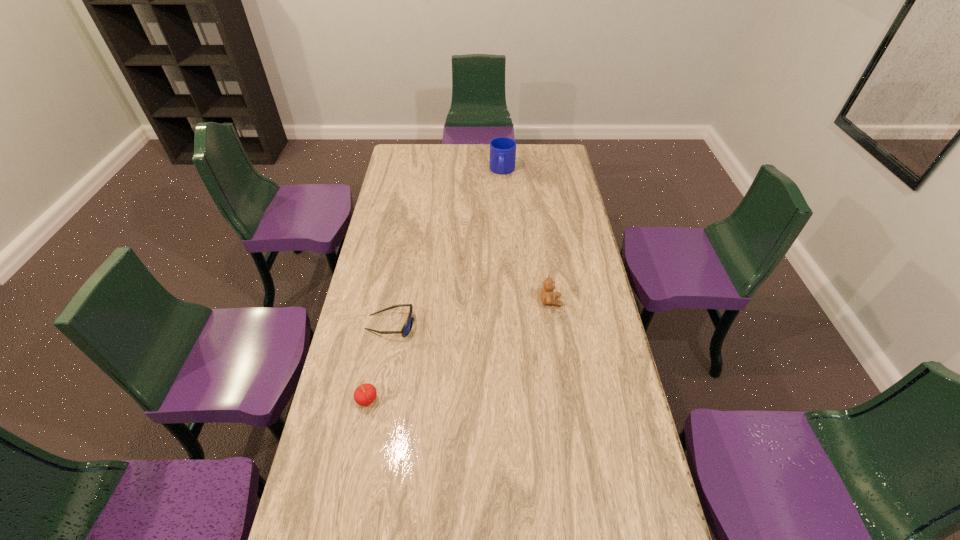
You are a GUI agent. You are given a task and a screenshot of the screen. Output one action in this format:
    pyautogui.click(x=<x>, y=<y>)
    Task: Click on the vacant position located 0.210m on the side with the handle of the mug
    The image size is (960, 540).
    Given the screenshot: What is the action you would take?
    pyautogui.click(x=498, y=207)

Where is `vacant space located on the side with the handle of the mug`? vacant space located on the side with the handle of the mug is located at coordinates (499, 200).

What are the coordinates of `vacant area situated 0.200m on the side with the handle of the mug` in the screenshot? It's located at (498, 206).

Find the location of `object situated at the far edge`. object situated at the far edge is located at coordinates (502, 149).

Find the location of `cherry that is positioned at the left edge`. cherry that is positioned at the left edge is located at coordinates (x=365, y=394).

Identify the location of sunglasses present at the left edge. (408, 324).

At what (x,y) coordinates should I click in order to perform the action: click on object that is at the right edge. Please return your answer as a coordinate pair (x, y). This screenshot has width=960, height=540. Looking at the image, I should click on (548, 296).

What are the coordinates of `vacant space at the far edge` in the screenshot? It's located at (450, 154).

The height and width of the screenshot is (540, 960). I want to click on vacant space at the left edge of the desktop, so click(363, 284).

In the image, there is a desktop. Identify the location of free space at the right edge. (545, 198).